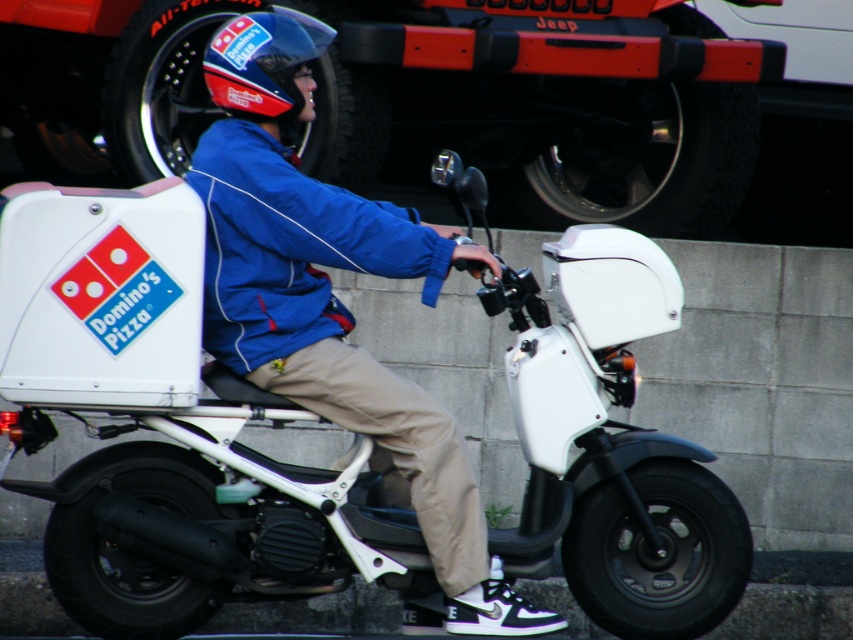
You are a delivery customer waiting at your apartment. You see a delivery person on a scooter with a Domino pizza box. The delivery person is wearing a blue jacket with white piping. Where is the blue fabric jacket at center located in relation to the point marked at coordinates (x=334, y=301)?

The point marked at coordinates (x=334, y=301) corresponds to the blue fabric jacket at center, so they are in the same location.

You are a delivery customer waiting at a crosswalk. You see two points in the image, one at point coordinates point [462,490] and another at point [264,120]. Which point is closer to you?

Point [462,490] is closer to the viewer than point [264,120].

You are a delivery supervisor checking the safety of the delivery route. You notice the white matte motorcycle at center and the blue fabric jacket at center in the image. Which object is wider in the scene?

The white matte motorcycle at center is wider than the blue fabric jacket at center according to the description.